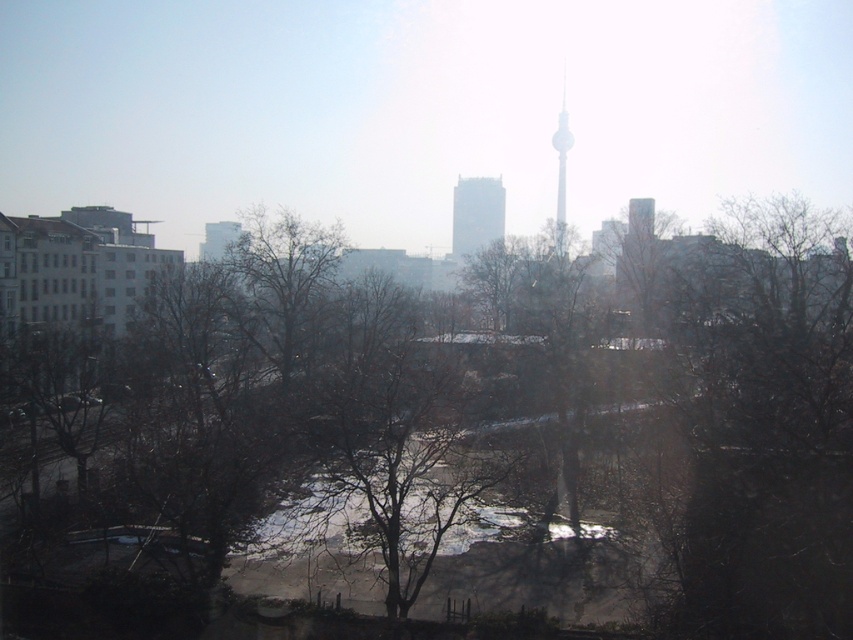
Question: Which point is farther to the camera?

Choices:
 (A) brown leafless tree at center
 (B) white glass tower at center

Answer: (B)

Question: Based on their relative distances, which object is nearer to the white glass tower at center?

Choices:
 (A) brown leafless tree at center
 (B) smooth glass skyscraper at center

Answer: (B)

Question: Can you confirm if brown leafless tree at center is smaller than white glass tower at center?

Choices:
 (A) no
 (B) yes

Answer: (A)

Question: Considering the relative positions of smooth glass skyscraper at center and white glass tower at center in the image provided, where is smooth glass skyscraper at center located with respect to white glass tower at center?

Choices:
 (A) above
 (B) below

Answer: (B)

Question: Is brown leafless tree at center to the right of smooth glass skyscraper at center from the viewer's perspective?

Choices:
 (A) yes
 (B) no

Answer: (B)

Question: Estimate the real-world distances between objects in this image. Which object is closer to the smooth glass skyscraper at center?

Choices:
 (A) white glass tower at center
 (B) brown leafless tree at center

Answer: (A)